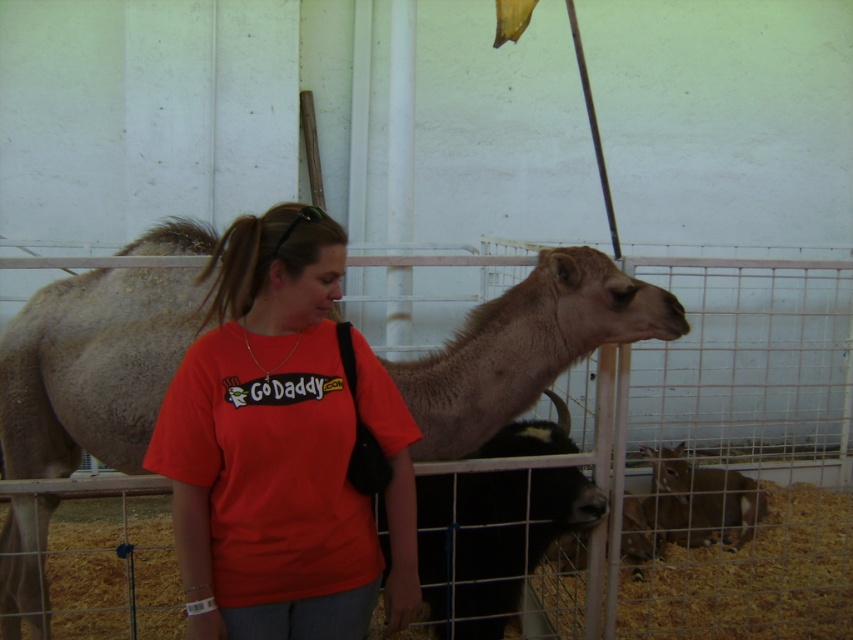
Question: Considering the relative positions of light brown fur at center and brown fur goat at lower right in the image provided, where is light brown fur at center located with respect to brown fur goat at lower right?

Choices:
 (A) below
 (B) above

Answer: (B)

Question: Which of the following is the farthest from the observer?

Choices:
 (A) (514, 323)
 (B) (653, 456)

Answer: (B)

Question: Does red cotton shirt at center have a larger size compared to black woolly cow at center?

Choices:
 (A) yes
 (B) no

Answer: (B)

Question: Which point is closer to the camera?

Choices:
 (A) (334, 556)
 (B) (157, 308)

Answer: (A)

Question: Can you confirm if light brown fur at center is positioned above black woolly cow at center?

Choices:
 (A) no
 (B) yes

Answer: (B)

Question: Considering the real-world distances, which object is closest to the red cotton shirt at center?

Choices:
 (A) black woolly cow at center
 (B) light brown fur at center
 (C) brown fur goat at lower right

Answer: (B)